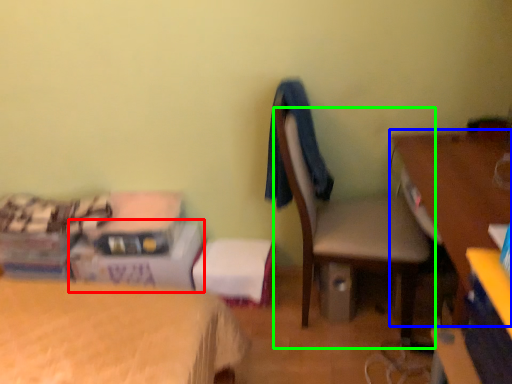
Question: Which object is the closest to the box (highlighted by a red box)? Choose among these: desk (highlighted by a blue box) or chair (highlighted by a green box).

Choices:
 (A) desk
 (B) chair

Answer: (B)